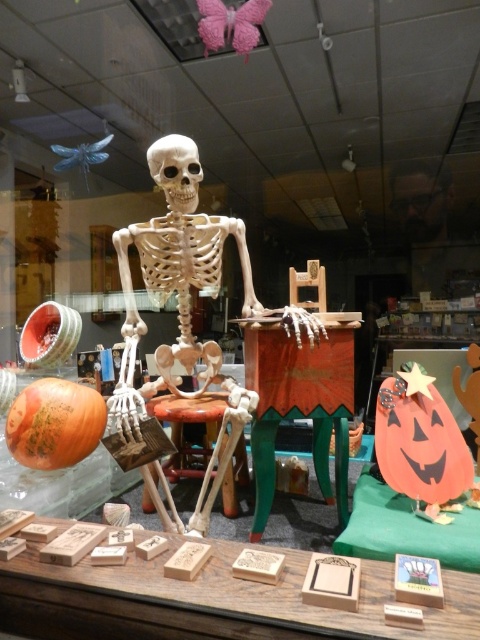
Question: Is white bone skeleton at center positioned before smooth beige skull at center?

Choices:
 (A) yes
 (B) no

Answer: (A)

Question: Is white bone skeleton at center positioned at the back of wooden stool at center?

Choices:
 (A) yes
 (B) no

Answer: (B)

Question: Which is nearer to the wooden stool at center?

Choices:
 (A) smooth beige skull at center
 (B) white bone skeleton at center

Answer: (B)

Question: Which point appears closest to the camera in this image?

Choices:
 (A) (424, 288)
 (B) (240, 472)

Answer: (B)

Question: Is bearded man at upper center further to camera compared to wooden stool at center?

Choices:
 (A) no
 (B) yes

Answer: (B)

Question: Which point appears farthest from the camera in this image?

Choices:
 (A) (392, 172)
 (B) (188, 145)
 (C) (204, 348)
 (D) (228, 500)

Answer: (A)